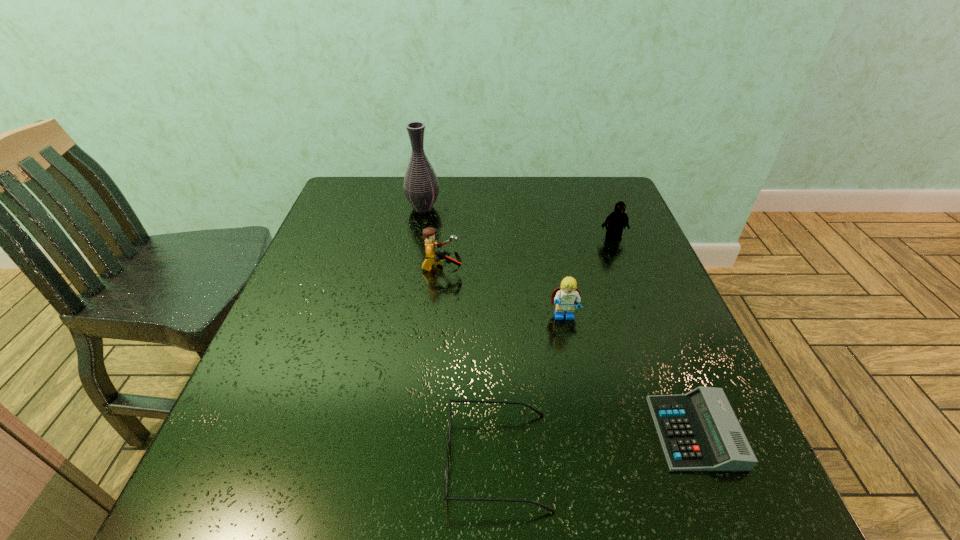
Locate an element on the screen. The width and height of the screenshot is (960, 540). vacant area located 0.130m on the left of the farthest object is located at coordinates (362, 207).

The height and width of the screenshot is (540, 960). Find the location of `free space located holding a crossbow in the hands of the leftmost Lego`. free space located holding a crossbow in the hands of the leftmost Lego is located at coordinates coord(512,269).

Where is `free space located 0.340m on the face of the farthest Lego`? The image size is (960, 540). free space located 0.340m on the face of the farthest Lego is located at coordinates (652, 339).

Locate an element on the screen. Image resolution: width=960 pixels, height=540 pixels. free space located 0.060m on the front-facing side of the fourth farthest object is located at coordinates (570, 349).

Locate an element on the screen. The image size is (960, 540). vacant space located on the front-facing side of the second shortest object is located at coordinates (410, 460).

This screenshot has height=540, width=960. In order to click on vacant space located on the front-facing side of the second shortest object in this screenshot , I will do `click(211, 460)`.

The height and width of the screenshot is (540, 960). In order to click on vacant space located on the front-facing side of the second shortest object in this screenshot , I will do `click(299, 460)`.

You are a GUI agent. You are given a task and a screenshot of the screen. Output one action in this format:
    pyautogui.click(x=<x>, y=<y>)
    Task: Click on the vacant area located on the left of the calculator
    The image size is (960, 540).
    Given the screenshot: What is the action you would take?
    pyautogui.click(x=581, y=433)

Identify the location of object situated at the far edge. This screenshot has width=960, height=540. (421, 187).

Locate an element on the screen. object at the near edge is located at coordinates (446, 480).